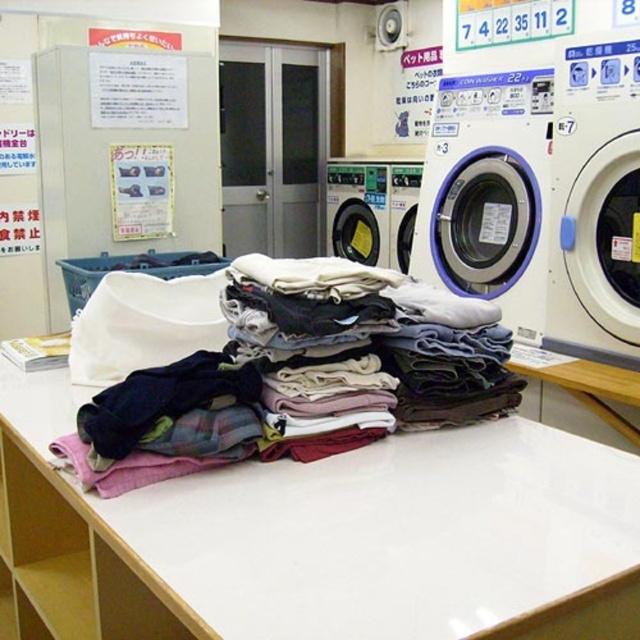
Does point (609, 65) come in front of point (404, 193)?

Yes, point (609, 65) is in front of point (404, 193).

Identify the location of white plastic washing machine at right. Image resolution: width=640 pixels, height=640 pixels. (595, 198).

Identify the location of white plastic washing machine at right. (595, 198).

Which is more to the left, white plastic washing machine at right or metallic gray washing machine at center?

metallic gray washing machine at center is more to the left.

Who is lower down, white plastic washing machine at right or metallic gray washing machine at center?

Positioned lower is white plastic washing machine at right.

The width and height of the screenshot is (640, 640). Find the location of `white plastic washing machine at right`. white plastic washing machine at right is located at coordinates (595, 198).

Who is more distant from viewer, (x=506, y=285) or (x=326, y=243)?

The point (x=326, y=243) is behind.

Can you confirm if white plastic washing machine at center-right is shorter than metallic gray washing machine at center?

No, white plastic washing machine at center-right is not shorter than metallic gray washing machine at center.

I want to click on white plastic washing machine at center-right, so click(x=490, y=180).